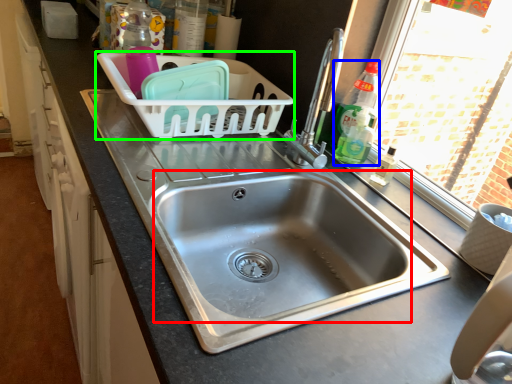
Question: Which object is positioned closest to sink (highlighted by a red box)? Select from bottle (highlighted by a blue box) and basket (highlighted by a green box).

Choices:
 (A) bottle
 (B) basket

Answer: (A)